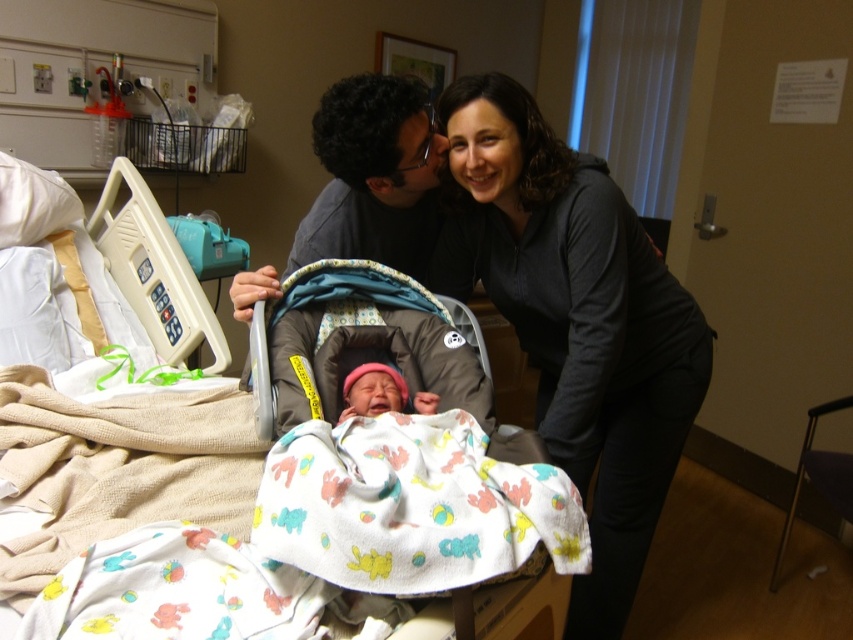
Question: Which object is farther from the camera taking this photo?

Choices:
 (A) dark gray sweater at center
 (B) matte gray stroller at center
 (C) soft fabric infant bed at center

Answer: (B)

Question: Which of these objects is positioned farthest from the dark gray sweater at center?

Choices:
 (A) matte gray stroller at center
 (B) brown fabric baby carriage at center
 (C) pink fabric newborn at center
 (D) soft fabric infant bed at center

Answer: (D)

Question: Is brown fabric baby carriage at center positioned behind pink fabric newborn at center?

Choices:
 (A) no
 (B) yes

Answer: (A)

Question: Does brown fabric baby carriage at center appear on the left side of matte gray stroller at center?

Choices:
 (A) no
 (B) yes

Answer: (A)

Question: Is soft fabric infant bed at center smaller than pink fabric newborn at center?

Choices:
 (A) yes
 (B) no

Answer: (B)

Question: Which is nearer to the dark gray sweater at center?

Choices:
 (A) brown fabric baby carriage at center
 (B) matte gray stroller at center

Answer: (B)